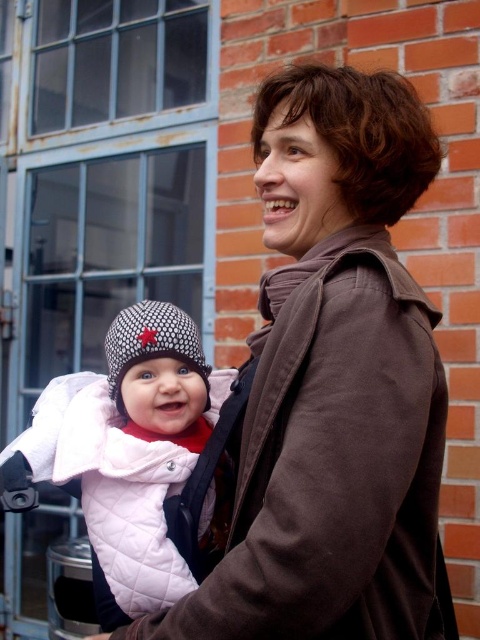
Does white quilted jacket at center have a smaller size compared to knitted woolen hat at center?

Actually, white quilted jacket at center might be larger than knitted woolen hat at center.

Is point (156, 499) farther from camera compared to point (159, 316)?

No, it is in front of (159, 316).

Where is `white quilted jacket at center`? white quilted jacket at center is located at coordinates (127, 448).

The width and height of the screenshot is (480, 640). In order to click on white quilted jacket at center in this screenshot , I will do `click(127, 448)`.

Does point (334, 125) come behind point (169, 348)?

No.

The height and width of the screenshot is (640, 480). What do you see at coordinates (333, 381) in the screenshot?
I see `brown suede coat at center` at bounding box center [333, 381].

Find the location of a particular element. The image size is (480, 640). brown suede coat at center is located at coordinates (333, 381).

Can you confirm if brown suede coat at center is wider than white quilted jacket at center?

Yes, brown suede coat at center is wider than white quilted jacket at center.

Which is behind, point (355, 467) or point (230, 372)?

The point (230, 372) is more distant.

Identify the location of brown suede coat at center. (333, 381).